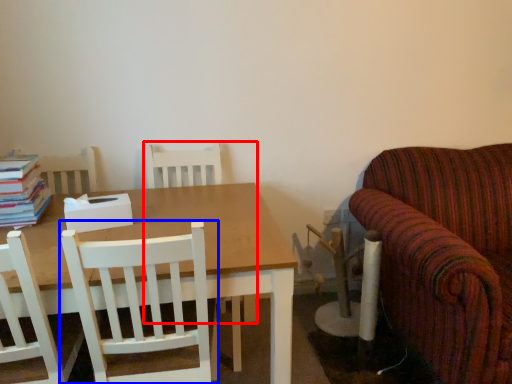
Question: Which point is further to the camera, chair (highlighted by a red box) or chair (highlighted by a blue box)?

Choices:
 (A) chair
 (B) chair

Answer: (A)